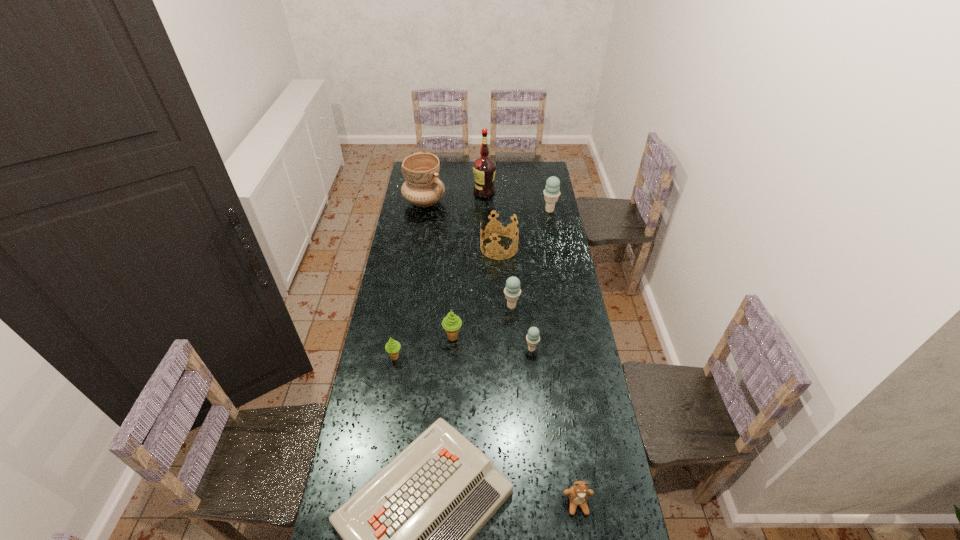
In order to click on the tallest object in this screenshot , I will do `click(484, 168)`.

At what (x,y) coordinates should I click in order to perform the action: click on brown alcohol. Please return your answer as a coordinate pair (x, y). Image resolution: width=960 pixels, height=540 pixels. Looking at the image, I should click on pyautogui.click(x=484, y=168).

Where is `the second tallest object`? The image size is (960, 540). the second tallest object is located at coordinates (422, 187).

The image size is (960, 540). In order to click on beige pottery in this screenshot , I will do `click(422, 187)`.

Identify the location of the rightmost icecream. (551, 193).

This screenshot has height=540, width=960. Find the location of `the eighth shortest object`. the eighth shortest object is located at coordinates (551, 193).

Locate an element on the screen. The height and width of the screenshot is (540, 960). the farther green icecream is located at coordinates (451, 323).

Locate an element on the screen. the bigger green icecream is located at coordinates (451, 323).

I want to click on the leftmost blue ice cream, so click(512, 291).

Where is `the second farthest blue ice cream`? This screenshot has height=540, width=960. the second farthest blue ice cream is located at coordinates (512, 291).